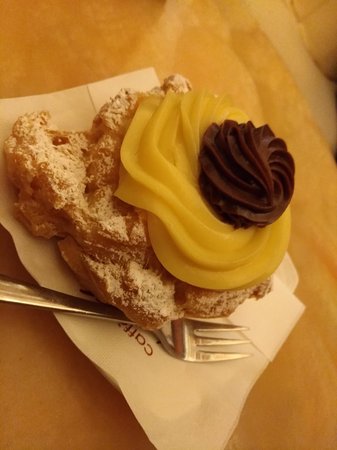
At what (x,y) coordinates should I click in order to perform the action: click on fork. Please return your answer as a coordinate pair (x, y). The image size is (337, 450). Looking at the image, I should click on (183, 347).